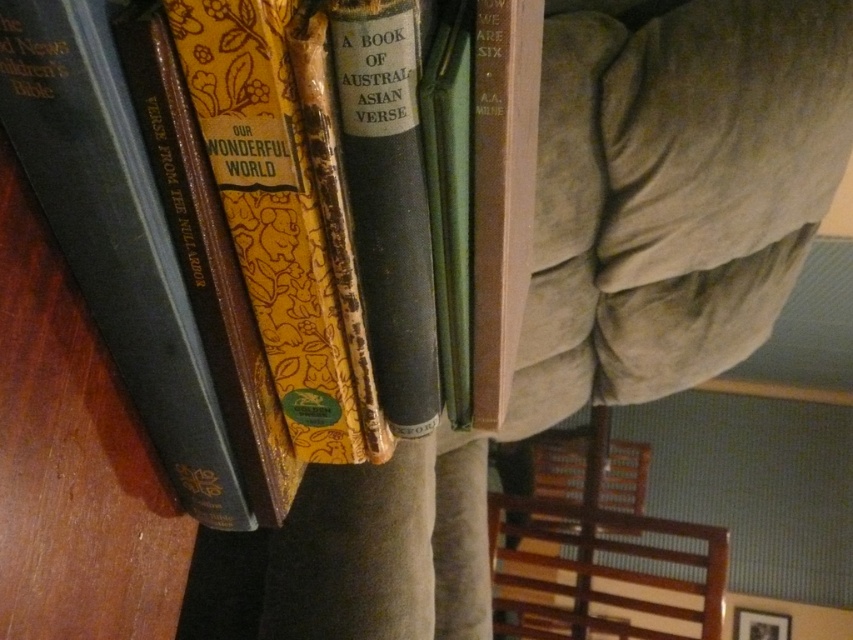
You are organizing a bookshelf and need to place the hardcover book at left and the brown wooden chair at lower right. Which object should you place first if you want to arrange them from thinnest to thickest?

You should place the hardcover book at left first since it is thinner than the brown wooden chair at lower right, ensuring the arrangement goes from thinnest to thickest.

You are organizing a bookshelf and need to place a new book that is 30 centimeters wide between the hardcover book at left and the hardcover book at center. Can the new book fit in the space between them?

The space between the hardcover book at left and the hardcover book at center is 27.89 centimeters. Since the new book is 30 centimeters wide, it cannot fit in the available space.

You are standing in front of the bookshelf and want to reach two points on the books. Which point, point (x=535, y=77) or point (x=566, y=614), is closer to you?

Point (x=535, y=77) is closer to the viewer than point (x=566, y=614).